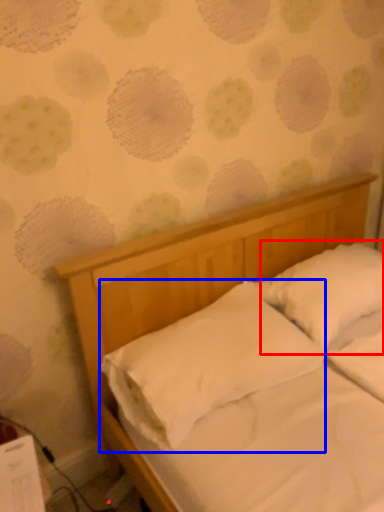
Question: Which object is closer to the camera taking this photo, pillow (highlighted by a red box) or pillow (highlighted by a blue box)?

Choices:
 (A) pillow
 (B) pillow

Answer: (B)